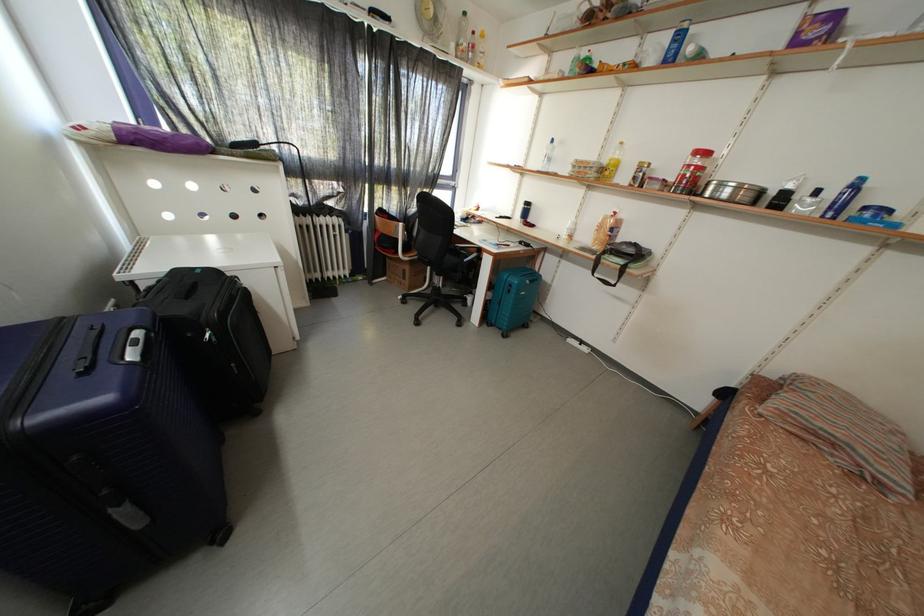
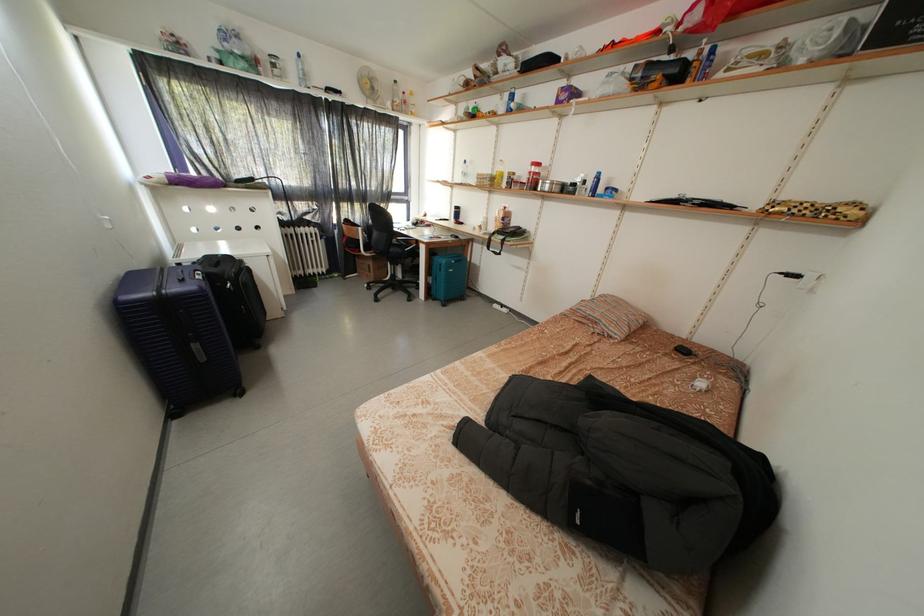
Find the pixel in the second image that matches pixel 678 172 in the first image.

(530, 180)